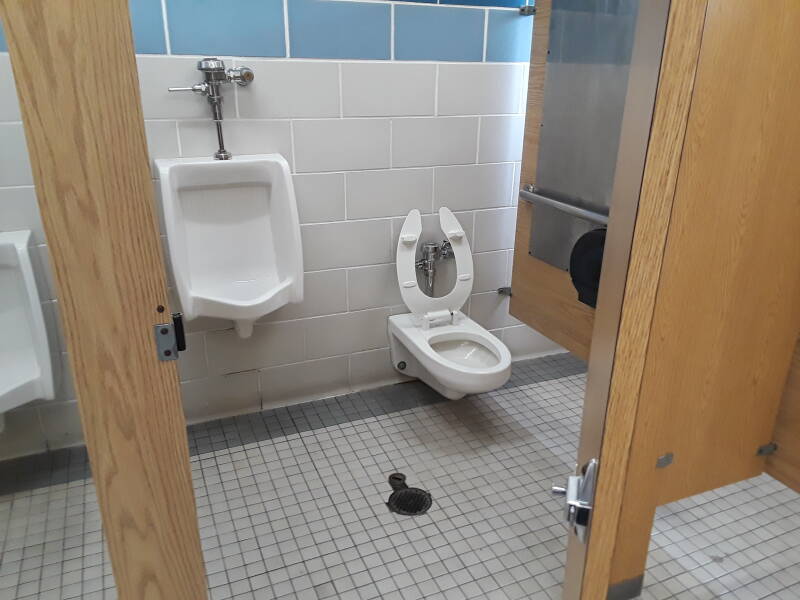
The image size is (800, 600). I want to click on glow of light, so click(x=514, y=110).